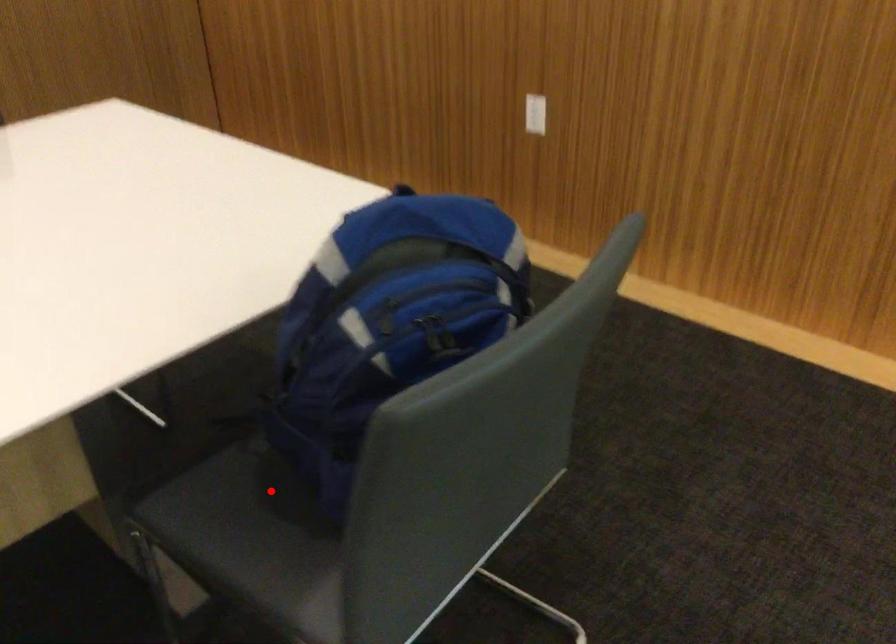
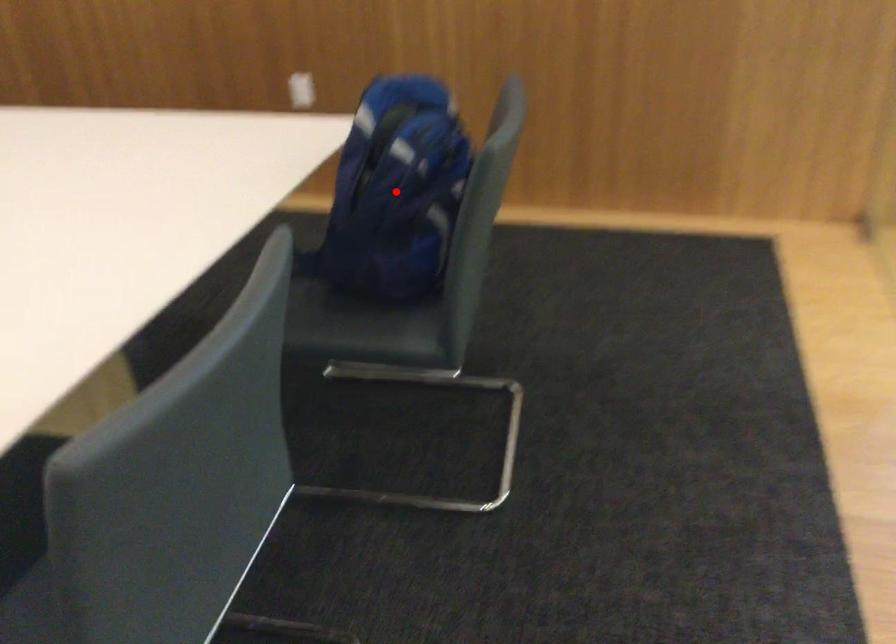
I am providing you with two images of the same scene from different viewpoints. A red point is marked on the first image and another point is marked on the second image. Do the highlighted points in image1 and image2 indicate the same real-world spot?

No